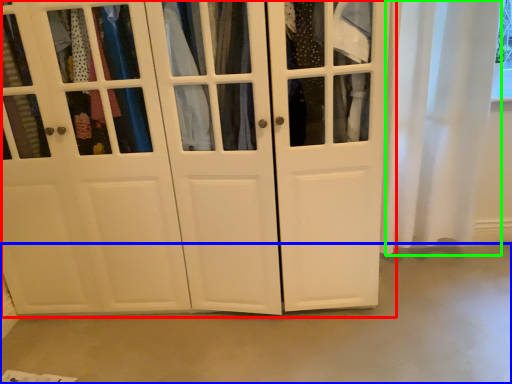
Question: Estimate the real-world distances between objects in this image. Which object is closer to cupboard (highlighted by a red box), concrete (highlighted by a blue box) or curtain (highlighted by a green box)?

Choices:
 (A) concrete
 (B) curtain

Answer: (A)